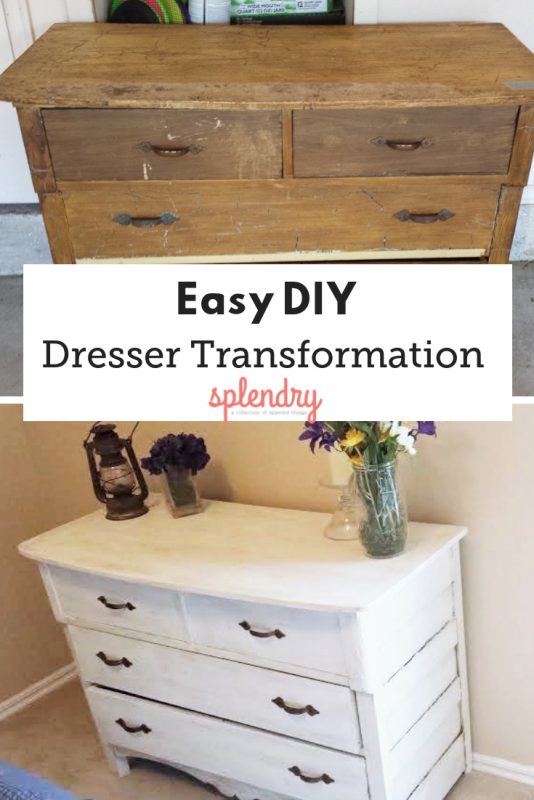
This screenshot has width=534, height=800. In order to click on handles in this screenshot , I will do `click(425, 221)`, `click(149, 222)`, `click(172, 153)`, `click(403, 145)`, `click(112, 606)`, `click(259, 633)`, `click(109, 660)`, `click(290, 708)`, `click(128, 728)`, `click(311, 778)`.